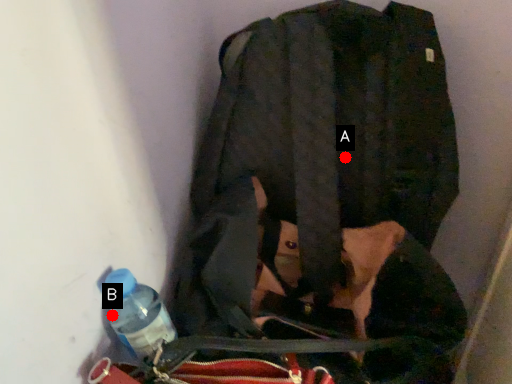
Question: Two points are circled on the image, labeled by A and B beside each circle. Among these points, which one is nearest to the camera?

Choices:
 (A) A is closer
 (B) B is closer

Answer: (B)